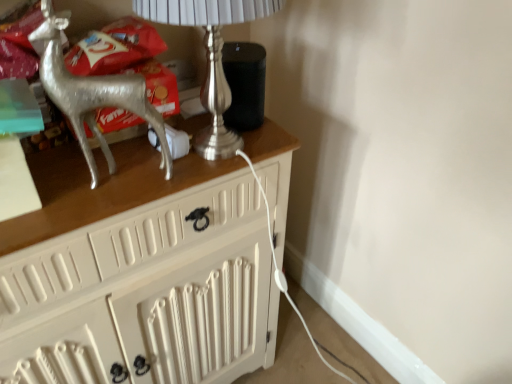
Question: Considering the positions of point (164, 165) and point (211, 114), is point (164, 165) closer or farther from the camera than point (211, 114)?

Choices:
 (A) closer
 (B) farther

Answer: (A)

Question: From the image's perspective, is silver metallic reindeer at left located above or below silver metallic table lamp at upper left?

Choices:
 (A) below
 (B) above

Answer: (A)

Question: Considering the positions of silver metallic reindeer at left and silver metallic table lamp at upper left in the image, is silver metallic reindeer at left wider or thinner than silver metallic table lamp at upper left?

Choices:
 (A) thin
 (B) wide

Answer: (A)

Question: Considering their positions, is silver metallic table lamp at upper left located in front of or behind silver metallic reindeer at left?

Choices:
 (A) front
 (B) behind

Answer: (B)

Question: In the image, is silver metallic table lamp at upper left on the left side or the right side of silver metallic reindeer at left?

Choices:
 (A) left
 (B) right

Answer: (B)

Question: Considering the positions of silver metallic table lamp at upper left and silver metallic reindeer at left in the image, is silver metallic table lamp at upper left wider or thinner than silver metallic reindeer at left?

Choices:
 (A) wide
 (B) thin

Answer: (A)

Question: Would you say silver metallic table lamp at upper left is inside or outside silver metallic reindeer at left?

Choices:
 (A) outside
 (B) inside

Answer: (A)